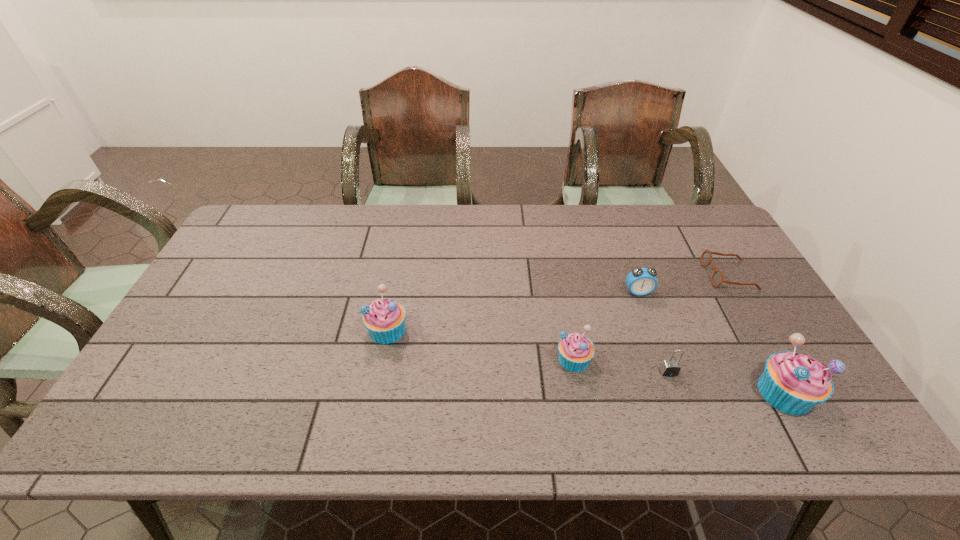
Where is `object present at the near right corner`? The image size is (960, 540). object present at the near right corner is located at coordinates (793, 383).

Where is `vacant space at the far edge of the desktop`? Image resolution: width=960 pixels, height=540 pixels. vacant space at the far edge of the desktop is located at coordinates (421, 232).

The width and height of the screenshot is (960, 540). Find the location of `vacant space at the near edge of the desktop`. vacant space at the near edge of the desktop is located at coordinates 528,383.

Locate an element on the screen. The width and height of the screenshot is (960, 540). vacant space at the right edge of the desktop is located at coordinates (775, 312).

Where is `free space at the far right corner of the desktop`? free space at the far right corner of the desktop is located at coordinates (708, 238).

Locate an element on the screen. vacant area that lies between the spectacles and the second tallest muffin is located at coordinates (558, 302).

Locate an element on the screen. Image resolution: width=960 pixels, height=540 pixels. vacant point located between the shortest object and the padlock is located at coordinates (699, 323).

Where is `vacant space that is in between the shortest object and the alarm clock`? This screenshot has height=540, width=960. vacant space that is in between the shortest object and the alarm clock is located at coordinates (684, 284).

The image size is (960, 540). Identify the location of empty location between the padlock and the alarm clock. (654, 332).

The height and width of the screenshot is (540, 960). What are the coordinates of `free space between the second object from left to right and the leftmost muffin` in the screenshot? It's located at (481, 345).